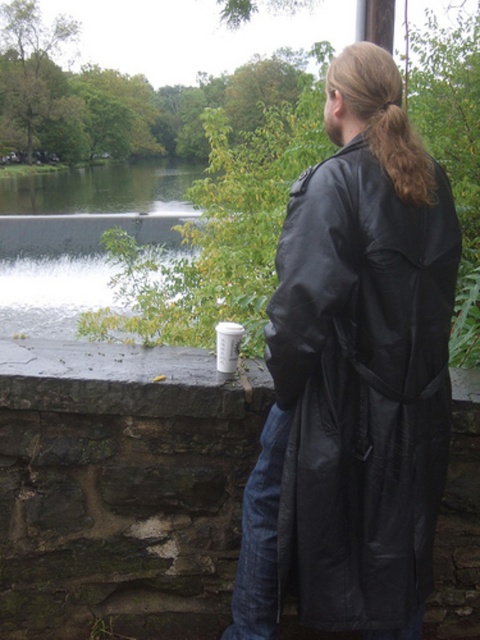
Is black leather jacket at upper right thinner than brown silky hair at upper right?

Incorrect, black leather jacket at upper right's width is not less than brown silky hair at upper right's.

Between point (394, 371) and point (365, 129), which one is positioned in front?

Point (394, 371) is in front.

Where is `black leather jacket at upper right`? black leather jacket at upper right is located at coordinates (361, 388).